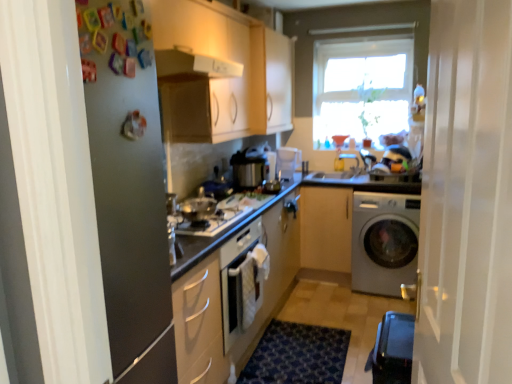
Question: Would you say matte white container at center, the 1th appliance viewed from the top, is inside or outside shiny silver gas stove at center?

Choices:
 (A) outside
 (B) inside

Answer: (A)

Question: From a real-world perspective, is matte white container at center, the second appliance when ordered from bottom to top, above or below shiny silver gas stove at center?

Choices:
 (A) below
 (B) above

Answer: (B)

Question: Estimate the real-world distances between objects in this image. Which object is farther from the white translucent screen door at right, which appears as the 2th screen door when viewed from the left?

Choices:
 (A) blue textured rug at lower center
 (B) satin silver washing machine at lower right
 (C) white glossy exhaust hood at upper center
 (D) light wood cabinet at center, placed as the third cabinetry when sorted from left to right
 (E) black plastic water heater at lower right

Answer: (D)

Question: Which object is the closest to the shiny silver gas stove at center?

Choices:
 (A) matte wood cabinet at upper center, which is the 2th cabinetry in right-to-left order
 (B) smooth granite countertop at center
 (C) transparent glass window at upper center
 (D) satin silver cooker at center, which is the second appliance from right to left
 (E) light wood cabinet at center, which is the first cabinetry in right-to-left order

Answer: (D)